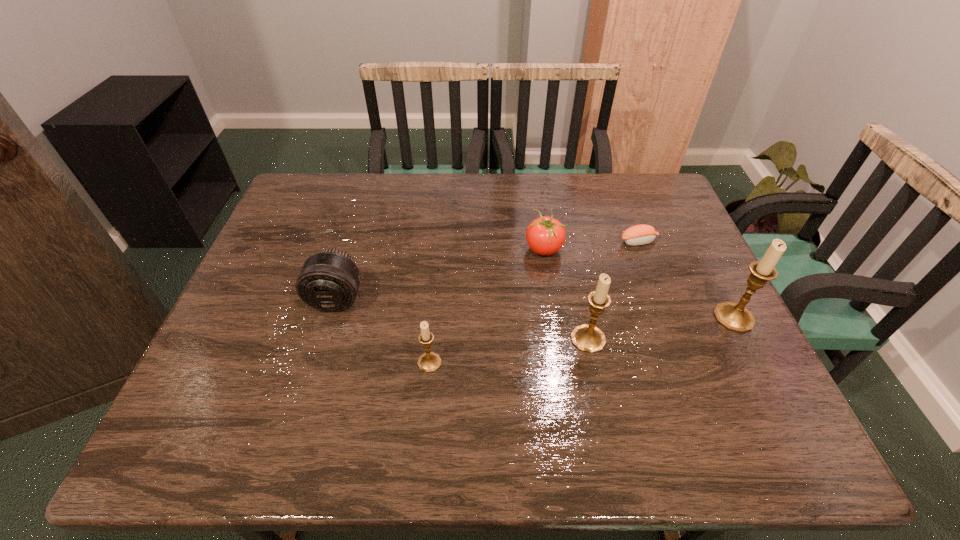
With all candle holders evenly spaced, where should an extra candle holder be placed on the left to continue the pattern? Please point out a vacant space. Please provide its 2D coordinates. Your answer should be formatted as a tuple, i.e. [(x, y)], where the tuple contains the x and y coordinates of a point satisfying the conditions above.

[(256, 388)]